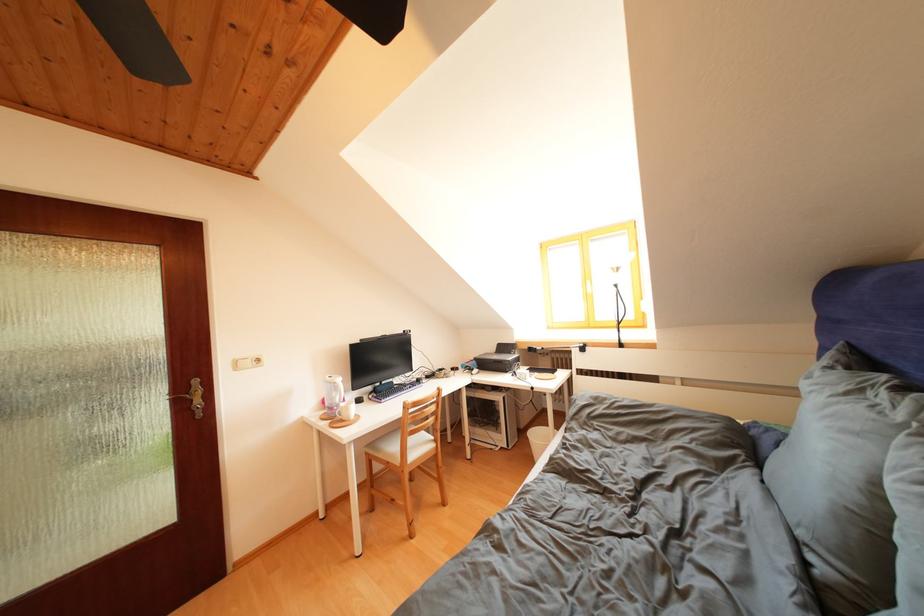
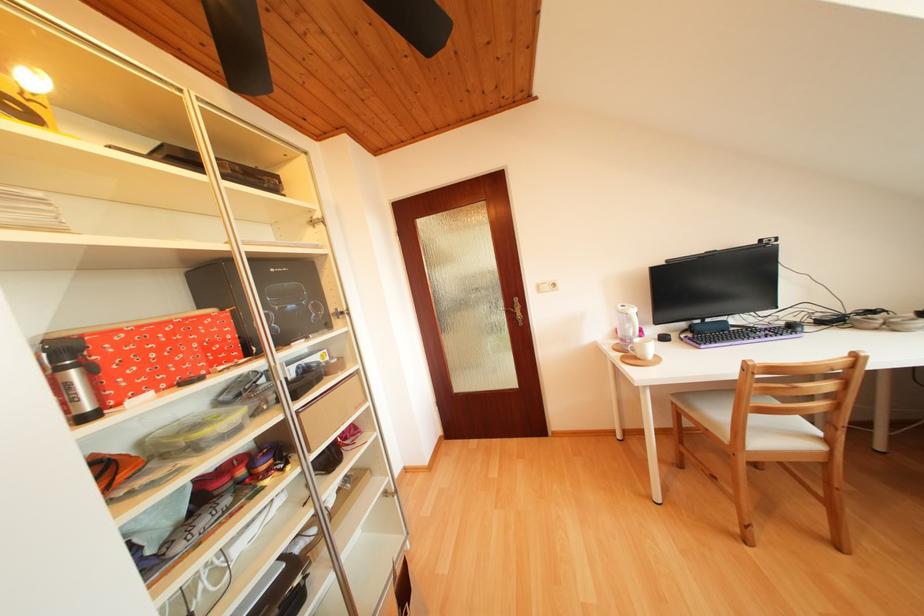
Locate, in the second image, the point that corresponds to pixel 453 509 in the first image.

(847, 553)